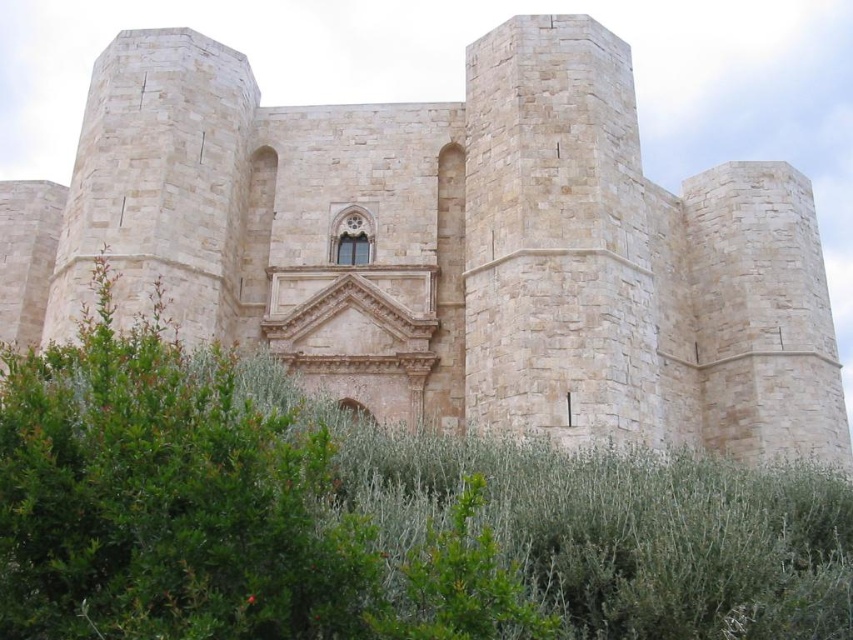
Question: Can you confirm if beige stone castle at center is positioned above green leafy bush at center?

Choices:
 (A) no
 (B) yes

Answer: (B)

Question: Can you confirm if beige stone castle at center is positioned to the left of green leafy bush at center?

Choices:
 (A) no
 (B) yes

Answer: (A)

Question: Which of the following is the closest to the observer?

Choices:
 (A) beige stone castle at center
 (B) green leafy bush at center

Answer: (B)

Question: Is beige stone castle at center to the left of green leafy bush at center from the viewer's perspective?

Choices:
 (A) yes
 (B) no

Answer: (B)